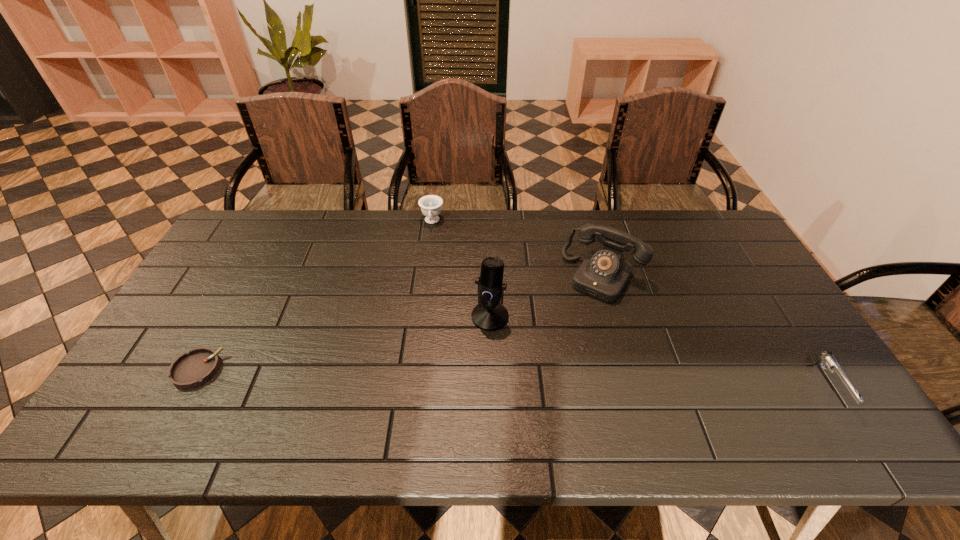
Locate an element on the screen. The image size is (960, 540). free space at the right edge of the desktop is located at coordinates (715, 279).

Where is `free region at the far left corner`? The height and width of the screenshot is (540, 960). free region at the far left corner is located at coordinates (236, 221).

This screenshot has height=540, width=960. Identify the location of free space at the near left corner of the desktop. (150, 407).

The width and height of the screenshot is (960, 540). Identify the location of unoccupied position between the telephone and the ashtray. (400, 323).

At what (x,y) coordinates should I click in order to perform the action: click on unoccupied area between the farthest object and the rightmost object. Please return your answer as a coordinate pair (x, y). Looking at the image, I should click on (630, 303).

I want to click on vacant space that is in between the telephone and the ashtray, so click(400, 323).

Identify the location of empty location between the teacup and the shortest object. click(x=315, y=296).

You are a GUI agent. You are given a task and a screenshot of the screen. Output one action in this format:
    pyautogui.click(x=<x>, y=<y>)
    Task: Click on the free space between the fourth object from left to right and the pistol
    The height and width of the screenshot is (540, 960).
    Given the screenshot: What is the action you would take?
    pyautogui.click(x=715, y=330)

In order to click on vacant region between the tallest object and the second object from left to right in this screenshot , I will do `click(461, 269)`.

This screenshot has width=960, height=540. I want to click on empty location between the farthest object and the leftmost object, so click(x=315, y=296).